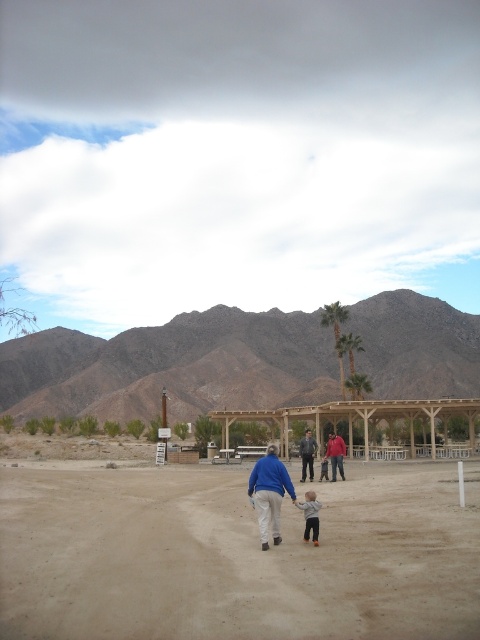
Question: Is blue cotton shirt at center below leather jacket at center?

Choices:
 (A) no
 (B) yes

Answer: (A)

Question: Which point appears closest to the camera in this image?

Choices:
 (A) (273, 451)
 (B) (300, 449)

Answer: (A)

Question: Is blue cotton shirt at center further to the viewer compared to red cotton shirt at center?

Choices:
 (A) yes
 (B) no

Answer: (B)

Question: Considering the real-world distances, which object is closest to the blue cotton shirt at center?

Choices:
 (A) light gray cotton shirt at center
 (B) red cotton shirt at center
 (C) brown sandy ground at center

Answer: (A)

Question: Which object is closer to the camera taking this photo?

Choices:
 (A) light gray cotton shirt at center
 (B) brown sandy ground at center

Answer: (B)

Question: Does brown sandy ground at center have a greater width compared to blue cotton shirt at center?

Choices:
 (A) yes
 (B) no

Answer: (A)